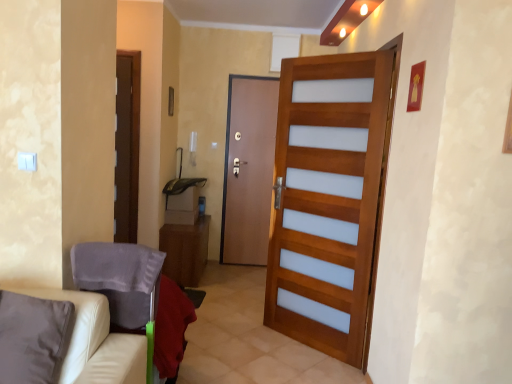
Locate an element on the screen. The height and width of the screenshot is (384, 512). free space in front of wooden door at center, the first door from the front is located at coordinates (296, 370).